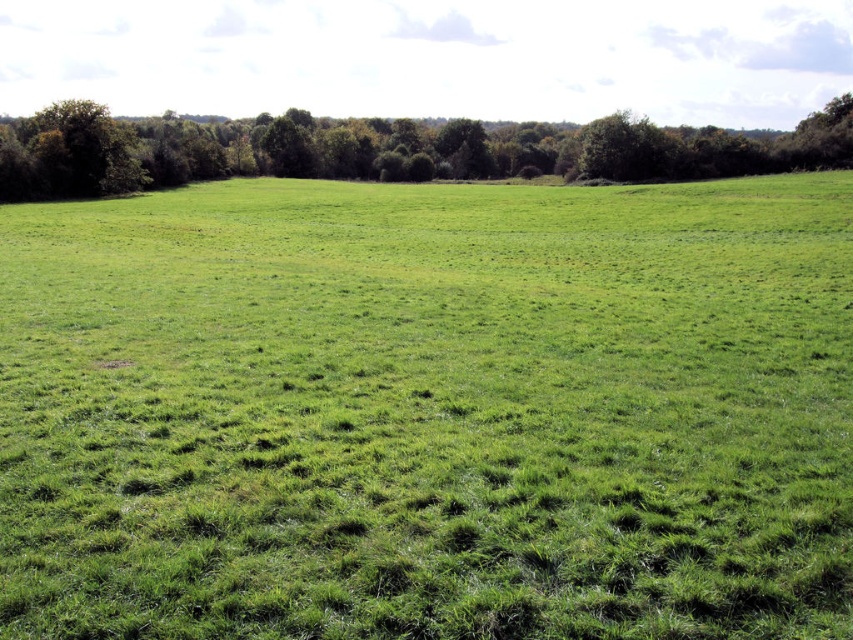
Question: Which object is closer to the camera taking this photo?

Choices:
 (A) green leafy trees at upper center
 (B) green grassy pasture at center

Answer: (B)

Question: Can you confirm if green grassy pasture at center is positioned below green leafy trees at upper center?

Choices:
 (A) yes
 (B) no

Answer: (A)

Question: Which point is closer to the camera?

Choices:
 (A) (463, 192)
 (B) (125, 125)

Answer: (A)

Question: Can you confirm if green grassy pasture at center is positioned below green leafy trees at upper center?

Choices:
 (A) no
 (B) yes

Answer: (B)

Question: Which point is farther to the camera?

Choices:
 (A) (726, 604)
 (B) (260, 141)

Answer: (B)

Question: Does green grassy pasture at center have a smaller size compared to green leafy trees at upper center?

Choices:
 (A) yes
 (B) no

Answer: (A)